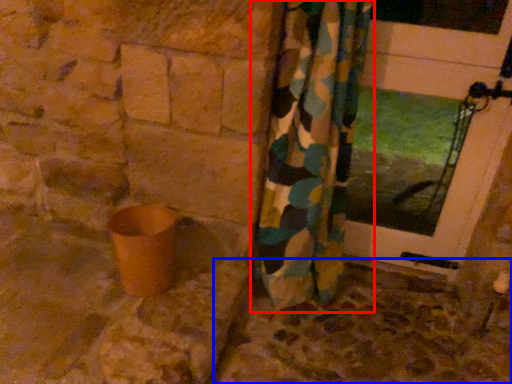
Question: Which of the following is the closest to the observer, curtain (highlighted by a red box) or concrete (highlighted by a blue box)?

Choices:
 (A) curtain
 (B) concrete

Answer: (A)